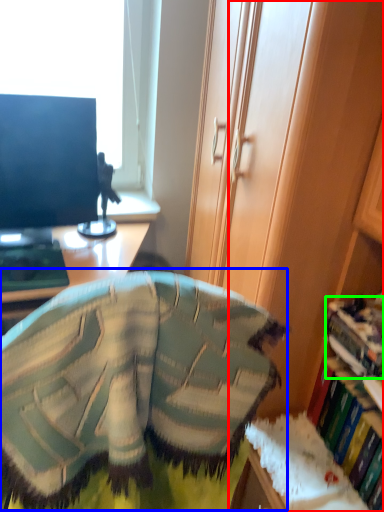
Question: Estimate the real-world distances between objects in this image. Which object is closer to cabinetry (highlighted by a red box), bean bag chair (highlighted by a blue box) or book (highlighted by a green box)?

Choices:
 (A) bean bag chair
 (B) book

Answer: (B)